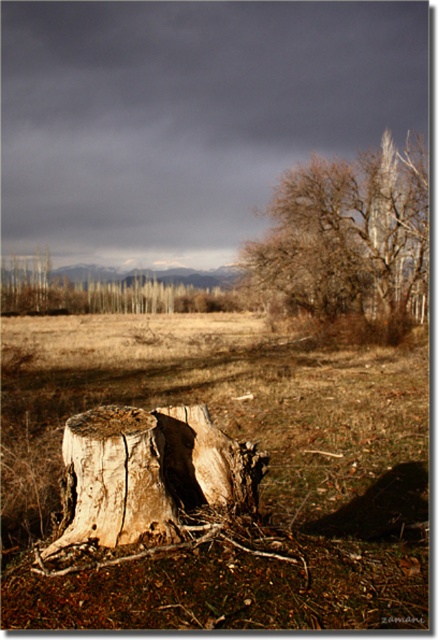
Looking at this image, can you confirm if brown wood stump at center is positioned above brown rough bark tree at upper right?

Incorrect, brown wood stump at center is not positioned above brown rough bark tree at upper right.

Measure the distance between point (x=388, y=371) and camera.

Point (x=388, y=371) and camera are 56.52 feet apart from each other.

Which is in front, point (380, 474) or point (276, 304)?

Positioned in front is point (380, 474).

This screenshot has width=438, height=640. In order to click on brown wood stump at center in this screenshot , I will do `click(233, 445)`.

Is point (13, 426) positioned in front of point (156, 513)?

No, it is not.

Does brown wood stump at center come behind light brown wood stump at center?

No, brown wood stump at center is in front of light brown wood stump at center.

What are the coordinates of `brown wood stump at center` in the screenshot? It's located at (233, 445).

Does brown rough bark tree at upper right have a greater height compared to light brown wood stump at center?

Yes.

Who is lower down, brown rough bark tree at upper right or light brown wood stump at center?

light brown wood stump at center is below.

Between point (339, 301) and point (87, 420), which one is positioned behind?

The point (339, 301) is more distant.

Find the location of `brown rough bark tree at upper right`. brown rough bark tree at upper right is located at coordinates (349, 237).